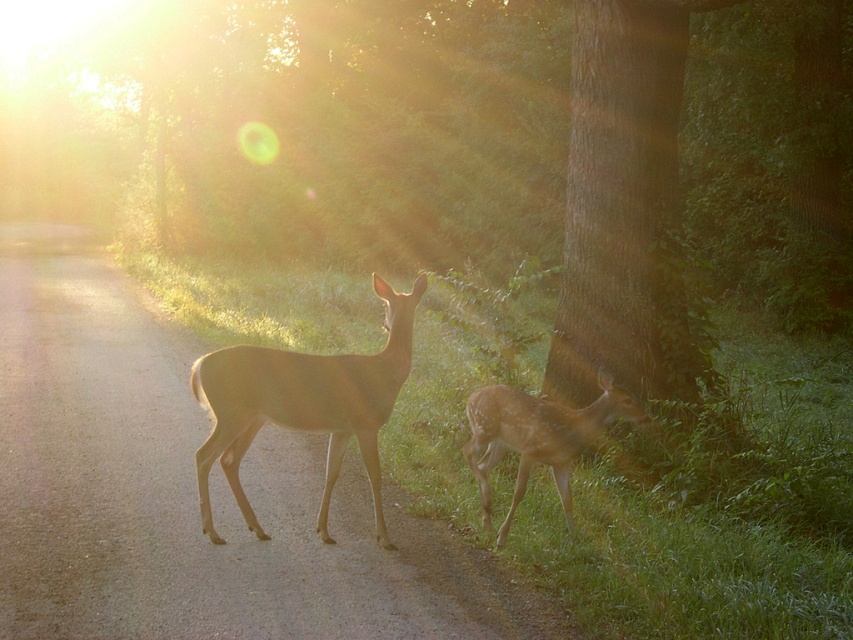
Question: Can you confirm if brown gravel path at center is positioned below spotted fur fawn at lower right?

Choices:
 (A) no
 (B) yes

Answer: (A)

Question: Does golden fur deer at center appear on the right side of spotted fur fawn at lower right?

Choices:
 (A) yes
 (B) no

Answer: (B)

Question: Estimate the real-world distances between objects in this image. Which object is farther from the spotted fur fawn at lower right?

Choices:
 (A) golden fur deer at center
 (B) brown gravel path at center

Answer: (B)

Question: Which object appears farthest from the camera in this image?

Choices:
 (A) spotted fur fawn at lower right
 (B) golden fur deer at center
 (C) brown gravel path at center

Answer: (B)

Question: Which point is closer to the camera?

Choices:
 (A) spotted fur fawn at lower right
 (B) brown gravel path at center

Answer: (B)

Question: Considering the relative positions of brown gravel path at center and spotted fur fawn at lower right in the image provided, where is brown gravel path at center located with respect to spotted fur fawn at lower right?

Choices:
 (A) above
 (B) below

Answer: (A)